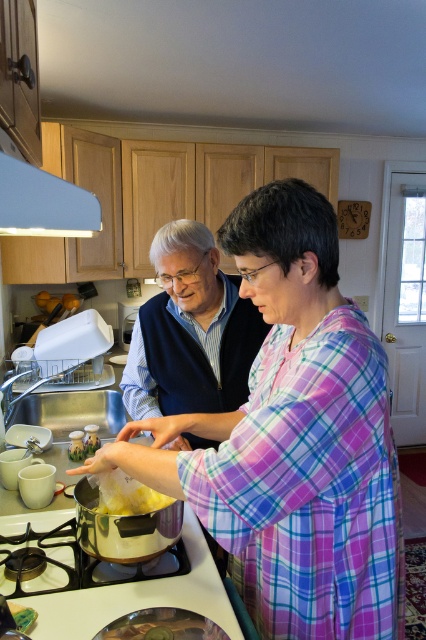
Is stainless steel pot at lower center taller than white matte exhaust hood at upper left?

Incorrect, stainless steel pot at lower center's height is not larger of white matte exhaust hood at upper left's.

Does point (69, 512) come closer to viewer compared to point (28, 225)?

No, it is not.

Is point (187, 528) more distant than point (51, 221)?

Yes, point (187, 528) is farther from viewer.

The width and height of the screenshot is (426, 640). In order to click on stainless steel pot at lower center in this screenshot , I will do `click(138, 596)`.

Is blue cotton vest at center to the left of white matte exhaust hood at upper left from the viewer's perspective?

In fact, blue cotton vest at center is to the right of white matte exhaust hood at upper left.

Image resolution: width=426 pixels, height=640 pixels. What are the coordinates of `blue cotton vest at center` in the screenshot? It's located at (190, 332).

Is white matte exhaust hood at upper left thinner than yellow matte food at center?

No, white matte exhaust hood at upper left is not thinner than yellow matte food at center.

Which of these two, white matte exhaust hood at upper left or yellow matte food at center, stands shorter?

Standing shorter between the two is white matte exhaust hood at upper left.

Does point (16, 225) come farther from viewer compared to point (115, 506)?

No, (16, 225) is in front of (115, 506).

Locate an element on the screen. This screenshot has height=640, width=426. white matte exhaust hood at upper left is located at coordinates (43, 204).